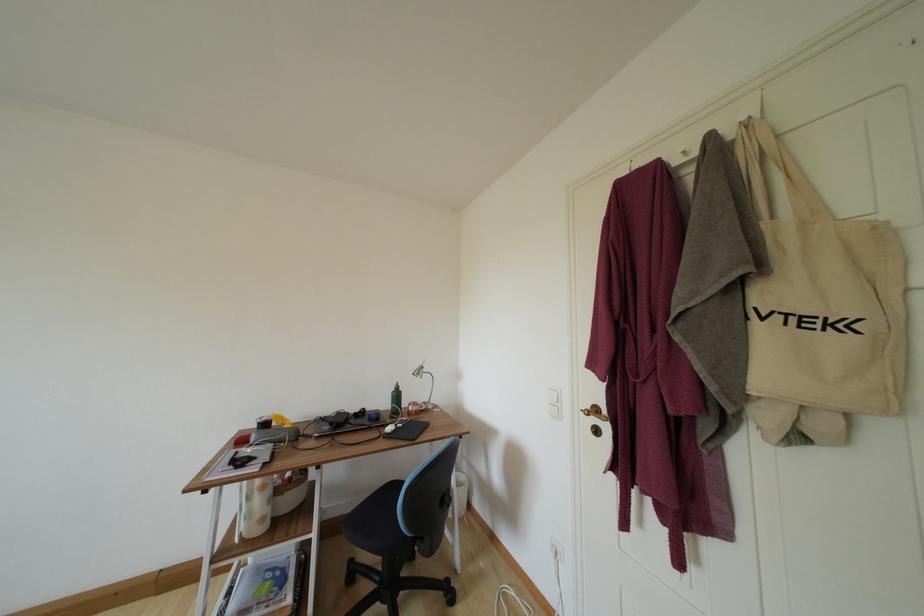
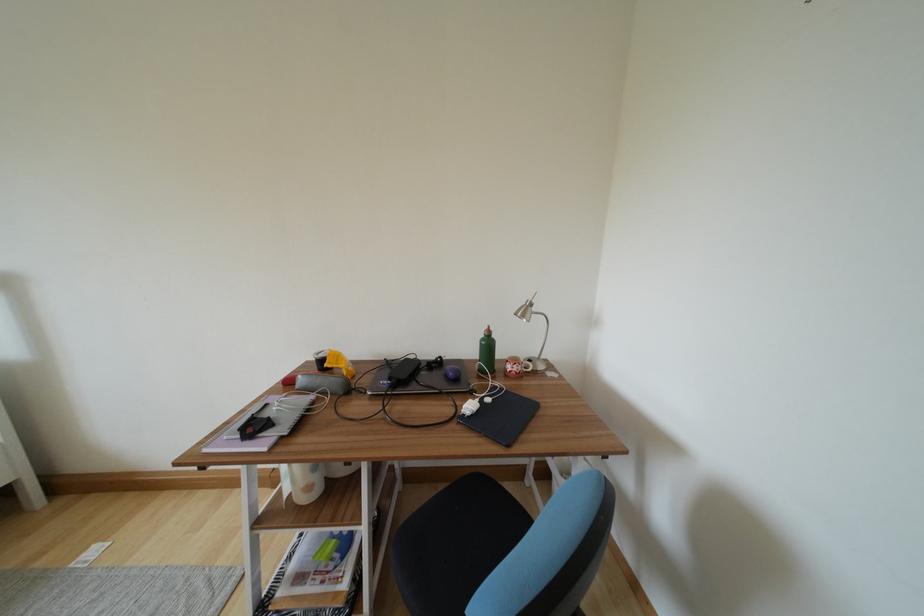
Find the pixel in the second image that matches the point at 266,524 in the first image.

(313, 492)